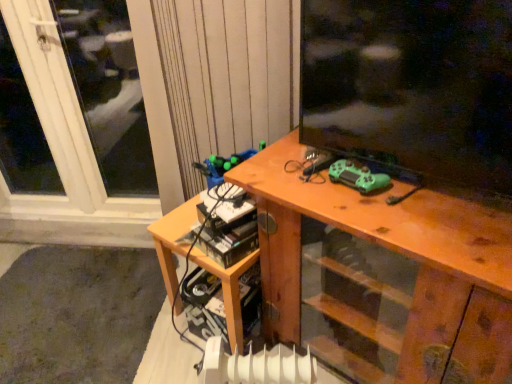
The width and height of the screenshot is (512, 384). What are the coordinates of `vacant area on top of wooden desk at center (from a real-world perspective)` in the screenshot? It's located at point(389,195).